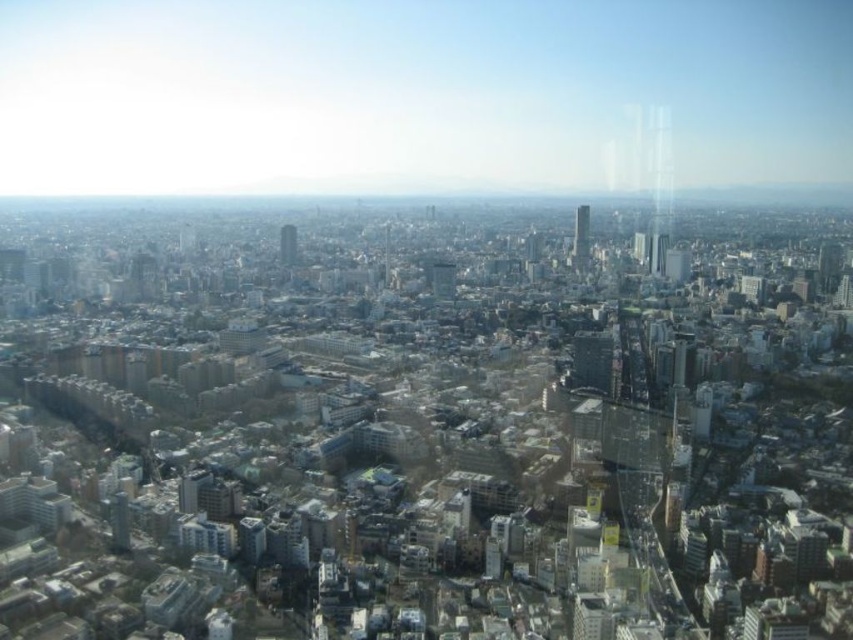
You are a drone operator planning to fly a drone between the green glass skyscraper at center and the glassy skyscraper at center. Based on the scene, can you determine which skyscraper is closer to you?

The green glass skyscraper at center is in front of the glassy skyscraper at center, so it is closer to you.

You are a drone operator tasked with navigating between two points in the city. You see the point at (576, 234) and the point at (289, 244). Which point is closer to your current position?

Point at (576, 234) is further to the viewer than point at (289, 244), so the point at (289, 244) is closer to your current position.

You are a drone operator who needs to deliver a package to the tallest skyscraper in the city. You see the green glass skyscraper at center and the glassy skyscraper at center. Which one should you fly towards?

The green glass skyscraper at center is taller than the glassy skyscraper at center, so you should fly towards the green glass skyscraper at center to deliver the package.